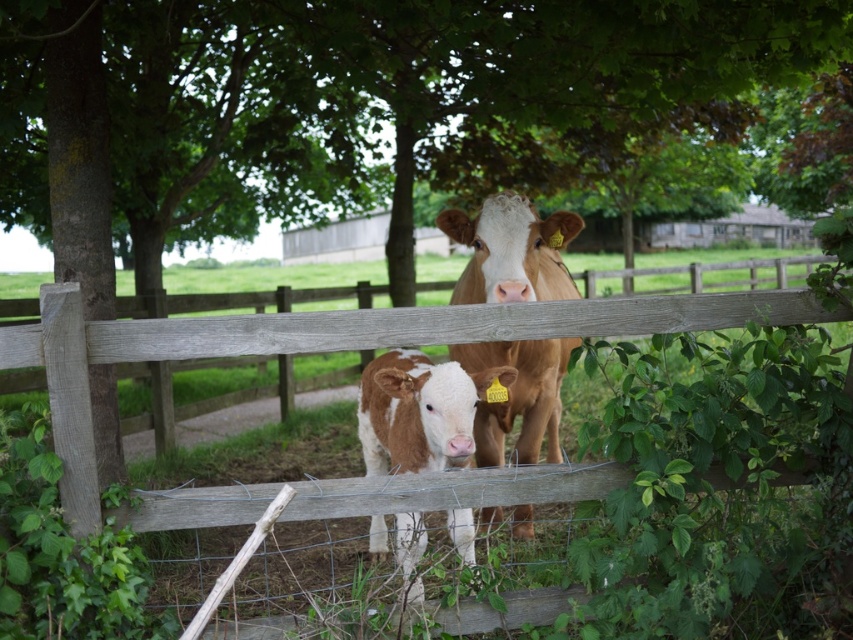
Who is positioned more to the left, brown smooth cow at center or brown speckled calf at center?

From the viewer's perspective, brown speckled calf at center appears more on the left side.

Consider the image. Is brown smooth cow at center behind brown speckled calf at center?

Yes, it is behind brown speckled calf at center.

Is point (517, 525) in front of point (430, 378)?

No, (517, 525) is behind (430, 378).

Find the location of a particular element. The width and height of the screenshot is (853, 640). brown smooth cow at center is located at coordinates pos(511,252).

Is weathered wood fence at center shorter than brown smooth cow at center?

Correct, weathered wood fence at center is not as tall as brown smooth cow at center.

Does point (384, 512) come closer to viewer compared to point (531, 355)?

That is True.

Identify the location of weathered wood fence at center. Image resolution: width=853 pixels, height=640 pixels. (329, 344).

The image size is (853, 640). What do you see at coordinates (329, 344) in the screenshot?
I see `weathered wood fence at center` at bounding box center [329, 344].

Between weathered wood fence at center and brown speckled calf at center, which one appears on the right side from the viewer's perspective?

Positioned to the right is weathered wood fence at center.

Measure the distance between weathered wood fence at center and camera.

They are 8.94 feet apart.

At what (x,y) coordinates should I click in order to perform the action: click on weathered wood fence at center. Please return your answer as a coordinate pair (x, y). Looking at the image, I should click on (329, 344).